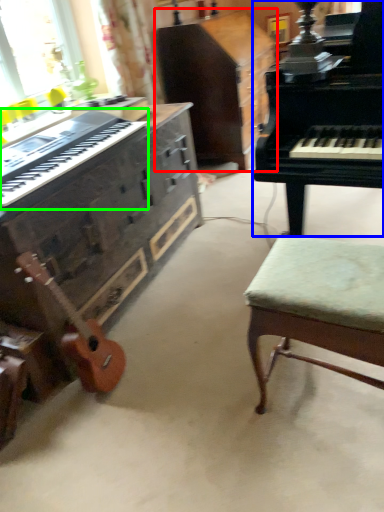
Question: Which object is positioned farthest from cabinetry (highlighted by a red box)? Select from piano (highlighted by a blue box) and musical keyboard (highlighted by a green box).

Choices:
 (A) piano
 (B) musical keyboard

Answer: (B)